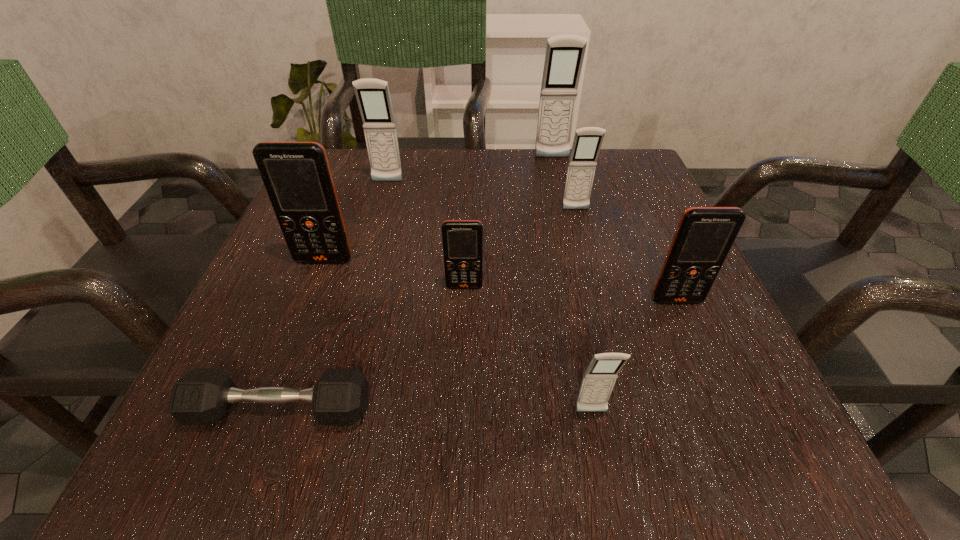
This screenshot has width=960, height=540. I want to click on the fourth nearest object, so click(x=462, y=240).

You are a GUI agent. You are given a task and a screenshot of the screen. Output one action in this format:
    pyautogui.click(x=<x>, y=<y>)
    Task: Click on the smallest orange cellular telephone
    This screenshot has width=960, height=540.
    Given the screenshot: What is the action you would take?
    pyautogui.click(x=462, y=240)

You are a GUI agent. You are given a task and a screenshot of the screen. Output one action in this format:
    pyautogui.click(x=<x>, y=<y>)
    Task: Click on the smallest gray cellular telephone
    This screenshot has height=540, width=960.
    Given the screenshot: What is the action you would take?
    pyautogui.click(x=598, y=381)

Identify the location of the nearest gray cellular telephone. The width and height of the screenshot is (960, 540). tap(598, 381).

Where is `the shortest object`? This screenshot has height=540, width=960. the shortest object is located at coordinates (202, 396).

This screenshot has height=540, width=960. Find the location of `vacant space located on the front-facing side of the biggest gray cellular telephone`. vacant space located on the front-facing side of the biggest gray cellular telephone is located at coordinates (564, 212).

In order to click on blank space located on the front-facing side of the leftmost gray cellular telephone in this screenshot , I will do tap(383, 199).

Where is `free space located on the screen of the farthest orange cellular telephone`? The image size is (960, 540). free space located on the screen of the farthest orange cellular telephone is located at coordinates (275, 392).

Locate an element on the screen. The width and height of the screenshot is (960, 540). free location located on the front-facing side of the third biggest gray cellular telephone is located at coordinates (585, 246).

Identify the location of free space located 0.090m on the screen of the second nearest cellular telephone. (699, 352).